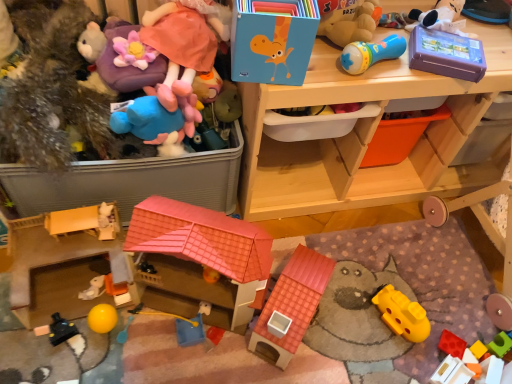
Identify the location of vacant space that's between yellow rubber ball at lower left, acting as the 11th toy starting from the right, and white plastic toy at lower right, arranged as the 3th toy when viewed from the right. This screenshot has width=512, height=384. [276, 355].